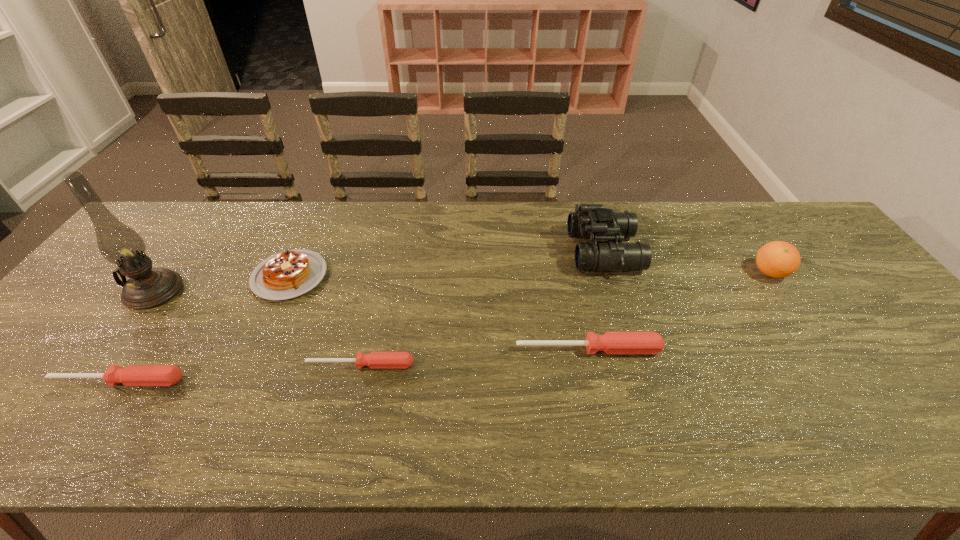
Find the location of a particular element. pancake is located at coordinates (288, 274).

Where is `vacant space located 0.060m on the right of the leftmost screwdriver`? The width and height of the screenshot is (960, 540). vacant space located 0.060m on the right of the leftmost screwdriver is located at coordinates (210, 381).

The height and width of the screenshot is (540, 960). In order to click on vacant area located on the right of the fourth object from right to left in this screenshot , I will do `click(541, 364)`.

Where is `free space located on the back of the fifth farthest object`? The width and height of the screenshot is (960, 540). free space located on the back of the fifth farthest object is located at coordinates (571, 272).

Find the location of a particular element. free spot located through the lenses of the second tallest object is located at coordinates (538, 251).

This screenshot has width=960, height=540. What are the coordinates of `vacant space located 0.300m through the lenses of the second tallest object` in the screenshot? It's located at (471, 251).

Locate an element on the screen. Image resolution: width=960 pixels, height=540 pixels. vacant space situated through the lenses of the second tallest object is located at coordinates (x=501, y=251).

Image resolution: width=960 pixels, height=540 pixels. I want to click on free point located on the front of the rightmost object, so click(851, 390).

Where is `free space located 0.070m on the front of the tallest object`? This screenshot has height=540, width=960. free space located 0.070m on the front of the tallest object is located at coordinates (123, 333).

The image size is (960, 540). I want to click on free space located on the right of the pancake, so click(x=404, y=276).